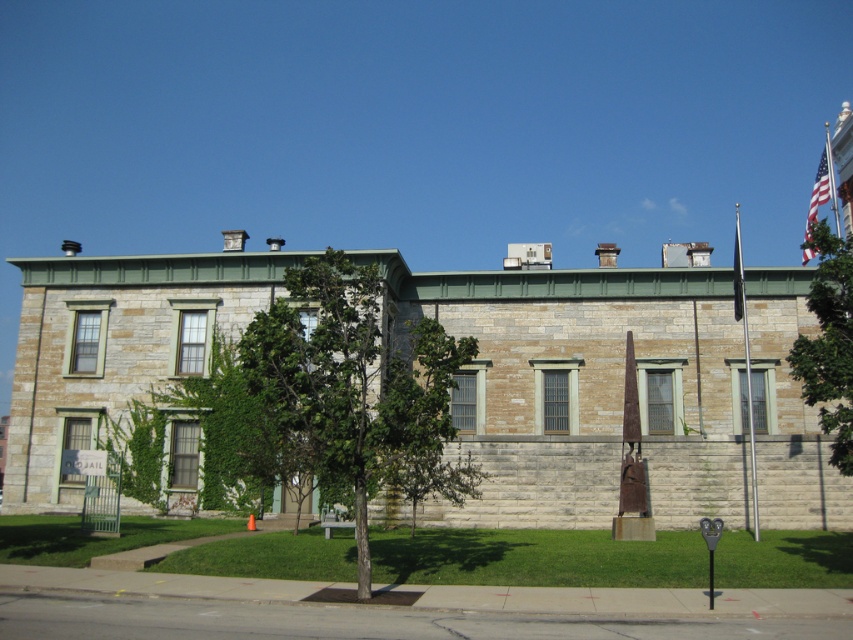
Is point (746, 369) farther from viewer compared to point (831, 179)?

Yes, it is behind point (831, 179).

Is polished metal flag pole at right taller than metallic flag pole at upper right?

No.

Is point (734, 273) closer to viewer compared to point (822, 124)?

Yes, point (734, 273) is in front of point (822, 124).

Locate an element on the screen. polished metal flag pole at right is located at coordinates point(746,364).

Can you confirm if green leafy tree at upper right is thinner than metallic flag pole at upper right?

Correct, green leafy tree at upper right's width is less than metallic flag pole at upper right's.

From the picture: Does green leafy tree at upper right have a larger size compared to metallic flag pole at upper right?

Actually, green leafy tree at upper right might be smaller than metallic flag pole at upper right.

Is point (816, 268) behind point (828, 176)?

Yes, point (816, 268) is farther from viewer.

The image size is (853, 640). I want to click on green leafy tree at upper right, so click(x=828, y=342).

Between point (328, 401) and point (817, 275), which one is positioned in front?

Point (328, 401)

Looking at this image, who is taller, green leafy tree at center or green leafy tree at upper right?

Standing taller between the two is green leafy tree at center.

Locate an element on the screen. This screenshot has height=640, width=853. green leafy tree at center is located at coordinates (349, 384).